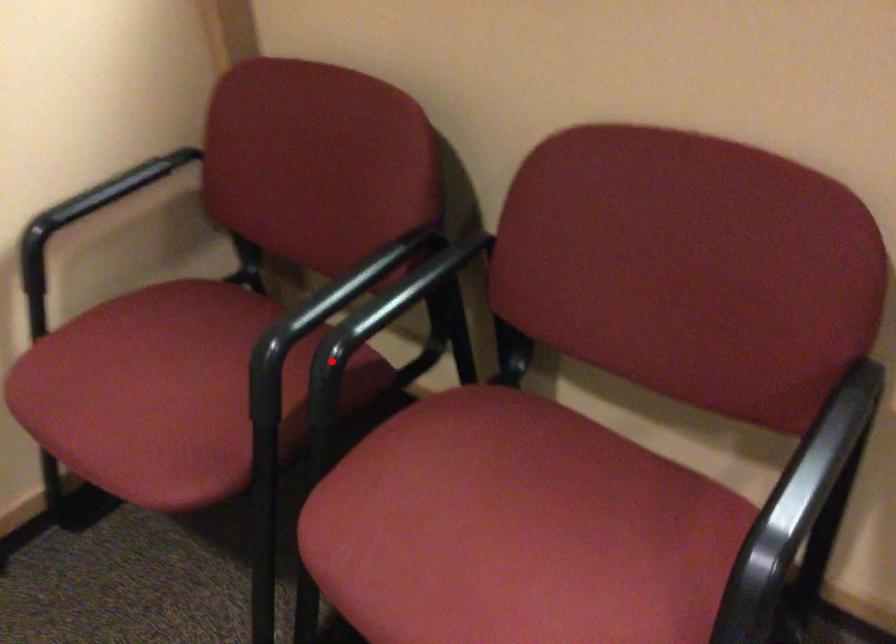
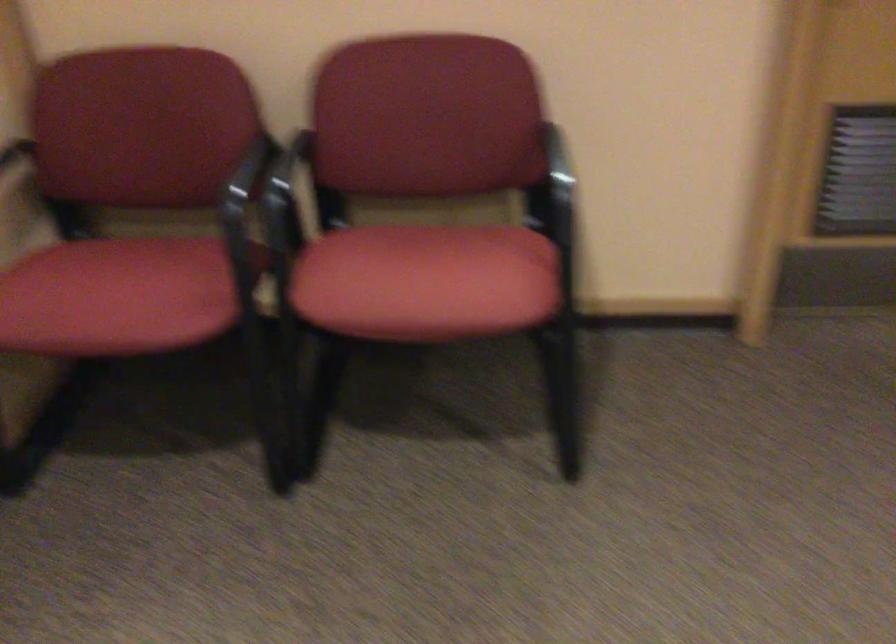
Where in the second image is the point corresponding to the highlighted location from the first image?

(286, 204)